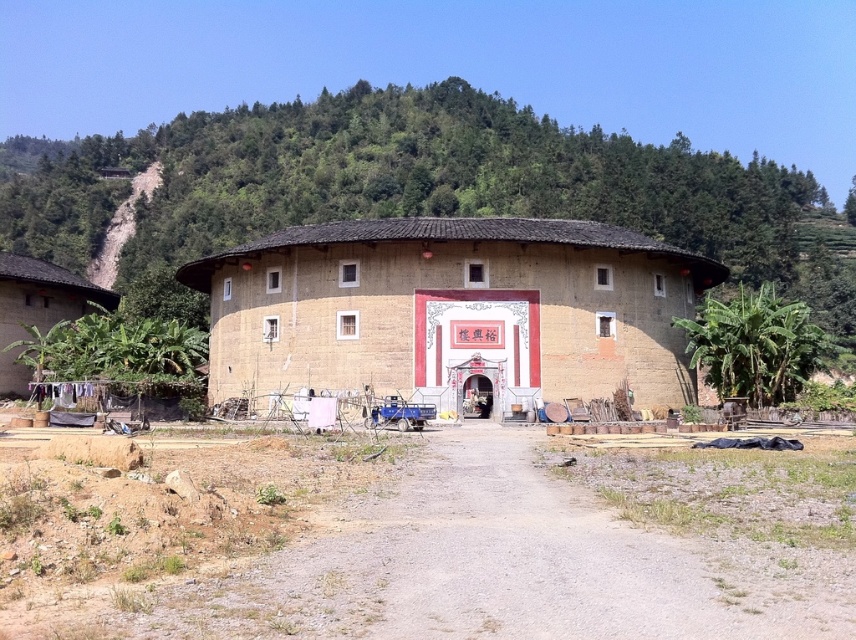
Is point (194, 154) closer to camera compared to point (492, 349)?

No.

Is brown clay house at center to the left of earthy clay roundhouse at center from the viewer's perspective?

In fact, brown clay house at center is to the right of earthy clay roundhouse at center.

At what (x,y) coordinates should I click in order to perform the action: click on brown clay house at center. Please return your answer as a coordinate pair (x, y). This screenshot has height=640, width=856. Looking at the image, I should click on (418, 188).

Which is more to the left, brown clay house at center or matte brown hut at lower left?

matte brown hut at lower left is more to the left.

Is brown clay house at center positioned before matte brown hut at lower left?

Yes, brown clay house at center is in front of matte brown hut at lower left.

The width and height of the screenshot is (856, 640). Describe the element at coordinates (418, 188) in the screenshot. I see `brown clay house at center` at that location.

The width and height of the screenshot is (856, 640). Identify the location of brown clay house at center. (418, 188).

Which of these two, earthy clay roundhouse at center or matte brown hut at lower left, stands shorter?

Standing shorter between the two is matte brown hut at lower left.

Does earthy clay roundhouse at center have a greater width compared to matte brown hut at lower left?

Yes.

Image resolution: width=856 pixels, height=640 pixels. In order to click on earthy clay roundhouse at center in this screenshot , I will do `click(452, 307)`.